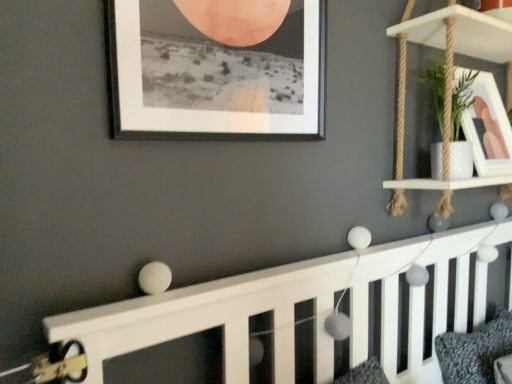
Question: Is white wood shelf at upper right smaller than black matte picture frame at upper center, positioned as the 1th picture frame in front-to-back order?

Choices:
 (A) no
 (B) yes

Answer: (A)

Question: Is white wood shelf at upper right touching black matte picture frame at upper center, positioned as the 2th picture frame in back-to-front order?

Choices:
 (A) no
 (B) yes

Answer: (A)

Question: Is white wood shelf at upper right not close to black matte picture frame at upper center, positioned as the 1th picture frame in front-to-back order?

Choices:
 (A) no
 (B) yes

Answer: (A)

Question: Could black matte picture frame at upper center, which is the second picture frame from right to left, be considered to be inside white wood shelf at upper right?

Choices:
 (A) yes
 (B) no

Answer: (B)

Question: Is white wood shelf at upper right further to the viewer compared to black matte picture frame at upper center, positioned as the 2th picture frame in back-to-front order?

Choices:
 (A) no
 (B) yes

Answer: (B)

Question: Considering the relative sizes of white wood shelf at upper right and black matte picture frame at upper center, the first picture frame positioned from the left, in the image provided, is white wood shelf at upper right thinner than black matte picture frame at upper center, the first picture frame positioned from the left,?

Choices:
 (A) yes
 (B) no

Answer: (B)

Question: Can you confirm if textured gray pillow at lower right is thinner than white glossy picture frame at upper right, marked as the first picture frame in a back-to-front arrangement?

Choices:
 (A) no
 (B) yes

Answer: (A)

Question: Is white glossy picture frame at upper right, arranged as the 2th picture frame when viewed from the left, at the back of textured gray pillow at lower right?

Choices:
 (A) no
 (B) yes

Answer: (A)

Question: Is textured gray pillow at lower right in front of white glossy picture frame at upper right, arranged as the 2th picture frame when viewed from the left?

Choices:
 (A) no
 (B) yes

Answer: (B)

Question: Does textured gray pillow at lower right appear on the left side of white glossy picture frame at upper right, marked as the first picture frame in a back-to-front arrangement?

Choices:
 (A) no
 (B) yes

Answer: (A)

Question: Is textured gray pillow at lower right far away from white glossy picture frame at upper right, marked as the first picture frame in a back-to-front arrangement?

Choices:
 (A) no
 (B) yes

Answer: (A)

Question: From a real-world perspective, is textured gray pillow at lower right located beneath white glossy picture frame at upper right, acting as the 2th picture frame starting from the front?

Choices:
 (A) no
 (B) yes

Answer: (B)

Question: Does textured gray pillow at lower right have a lesser width compared to white wood shelf at upper right?

Choices:
 (A) no
 (B) yes

Answer: (A)